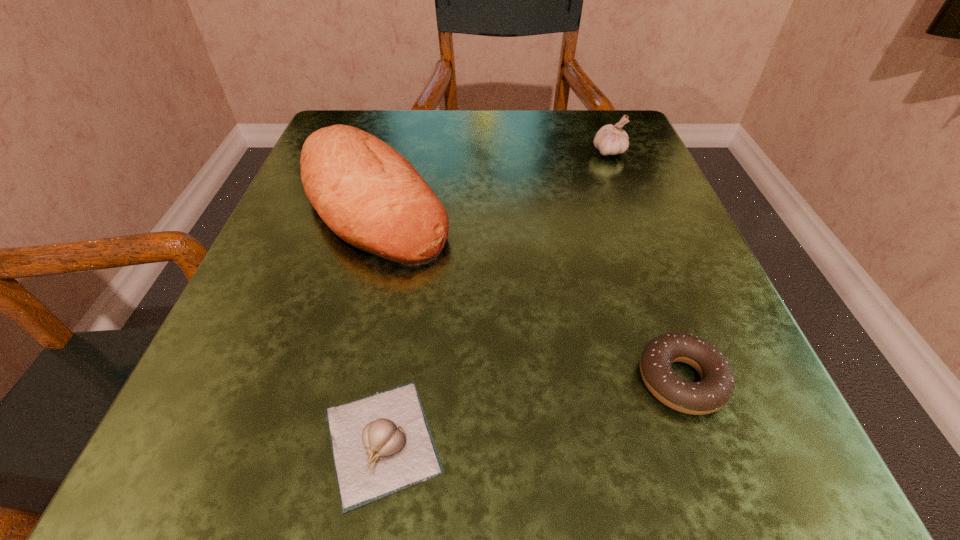
The width and height of the screenshot is (960, 540). Identify the location of bread present at the far edge. (368, 194).

This screenshot has width=960, height=540. What are the coordinates of `garlic present at the far edge` in the screenshot? It's located at (610, 140).

At what (x,y) coordinates should I click in order to perform the action: click on object that is at the near edge. Please return your answer as a coordinate pair (x, y). The image size is (960, 540). Looking at the image, I should click on (381, 444).

Find the location of `bread at the left edge`. bread at the left edge is located at coordinates (368, 194).

Find the location of a particular element. garlic situated at the left edge is located at coordinates (381, 444).

The height and width of the screenshot is (540, 960). In order to click on garlic located at the right edge in this screenshot , I will do `click(610, 140)`.

At what (x,y) coordinates should I click in order to perform the action: click on doughnut located in the right edge section of the desktop. Please return your answer as a coordinate pair (x, y). Looking at the image, I should click on (716, 387).

You are a GUI agent. You are given a task and a screenshot of the screen. Output one action in this format:
    pyautogui.click(x=<x>, y=<y>)
    Task: Click on the object that is at the far left corner
    
    Given the screenshot: What is the action you would take?
    pyautogui.click(x=368, y=194)

At what (x,y) coordinates should I click in order to perform the action: click on object present at the near left corner. Please return your answer as a coordinate pair (x, y). The image size is (960, 540). Looking at the image, I should click on (381, 444).

Locate an element on the screen. object that is at the far right corner is located at coordinates (610, 140).